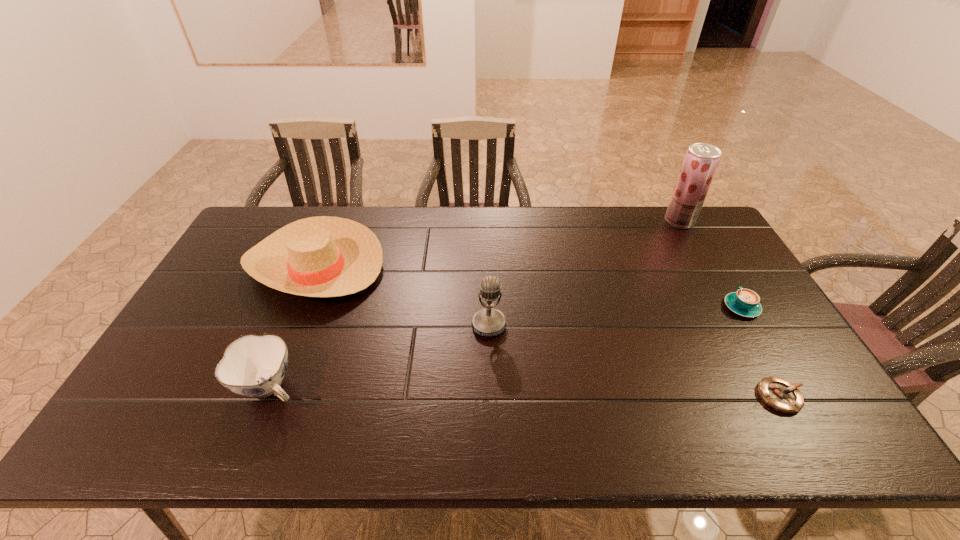
The width and height of the screenshot is (960, 540). Find the location of `free location located 0.050m on the right of the chinaware`. free location located 0.050m on the right of the chinaware is located at coordinates (326, 387).

I want to click on free location located 0.050m with the handle on the right side of the fifth tallest object, so click(728, 284).

Where is `free space located 0.090m with the handle on the right side of the fifth tallest object`? The height and width of the screenshot is (540, 960). free space located 0.090m with the handle on the right side of the fifth tallest object is located at coordinates (722, 275).

Locate an element on the screen. vacant space located 0.330m with the handle on the right side of the fifth tallest object is located at coordinates (695, 229).

The image size is (960, 540). Identify the location of vacant region located on the back of the ashtray. (711, 274).

I want to click on fruit juice present at the far edge, so click(x=701, y=161).

You are a GUI agent. You are given a task and a screenshot of the screen. Output one action in this format:
    pyautogui.click(x=<x>, y=<y>)
    Task: Click on the sunhat that is at the far edge
    
    Given the screenshot: What is the action you would take?
    pyautogui.click(x=324, y=256)

Locate an element on the screen. chinaware situated at the near edge is located at coordinates (252, 366).

Where is `ashtray present at the near edge`? ashtray present at the near edge is located at coordinates (779, 394).

Where is `object present at the left edge`? The height and width of the screenshot is (540, 960). object present at the left edge is located at coordinates (324, 256).